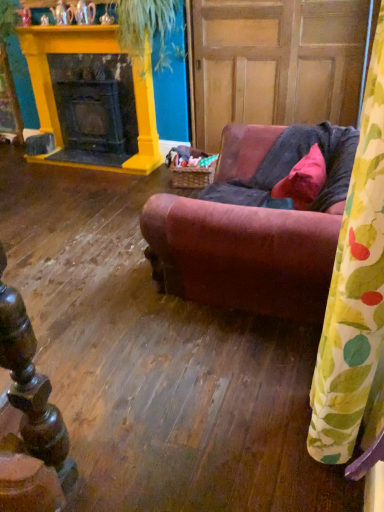
Question: In the image, is matte pink fabric pillow at center on the left side or the right side of leather couch at center?

Choices:
 (A) right
 (B) left

Answer: (A)

Question: Is matte pink fabric pillow at center taller or shorter than leather couch at center?

Choices:
 (A) short
 (B) tall

Answer: (A)

Question: Which object is the farthest from the yellow painted wood fireplace at upper left?

Choices:
 (A) yellow-green leaf-patterned curtain at right
 (B) leather couch at center
 (C) wooden paneling at center
 (D) green leafy plant at upper center
 (E) matte pink fabric pillow at center

Answer: (A)

Question: Which object is positioned farthest from the green leafy plant at upper center?

Choices:
 (A) yellow-green leaf-patterned curtain at right
 (B) leather couch at center
 (C) yellow painted wood fireplace at upper left
 (D) matte pink fabric pillow at center
 (E) wooden paneling at center

Answer: (A)